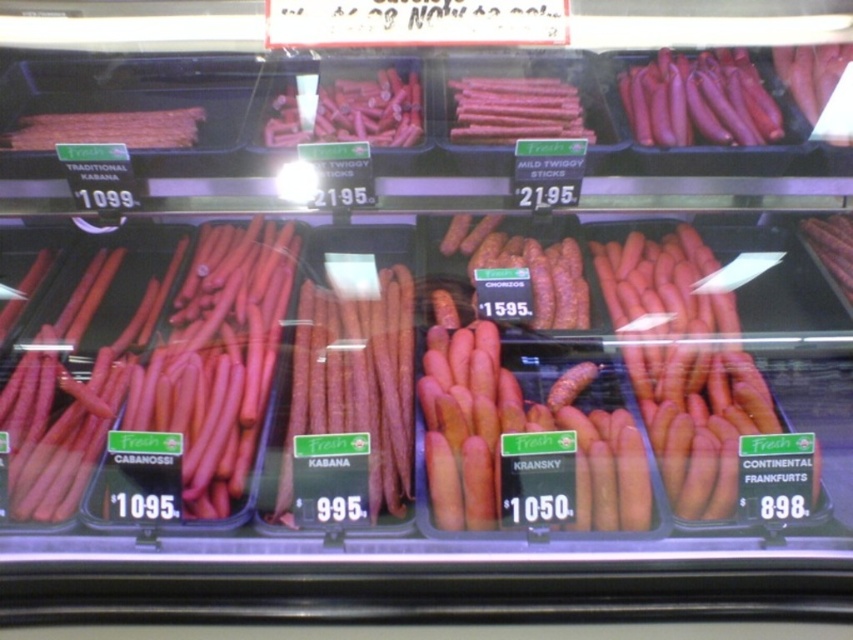
You are a grocery store employee who needs to restock the refrigerated display case. You have a new batch of pink glossy sausages at upper right and a matte pink stick at center. According to the current arrangement, where should you place each item to maintain the existing layout?

The pink glossy sausages at upper right should be placed above the matte pink stick at center to maintain the existing layout as per the description.

You are a grocery store employee who needs to stack the matte pink stick at center and the smooth pink stick at center on a shelf. The shelf has limited vertical space, and you want to place the taller item on the bottom for stability. Which stick should go on the bottom?

The matte pink stick at center should go on the bottom because it has a greater height compared to the smooth pink stick at center, ensuring stability.